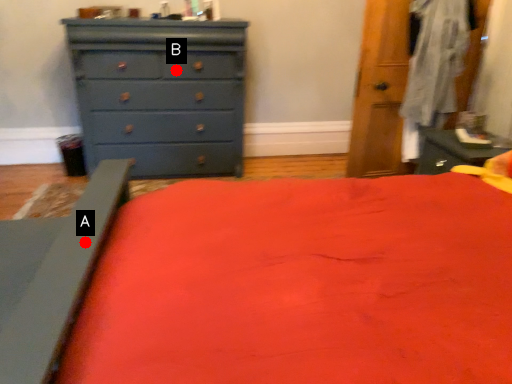
Question: Two points are circled on the image, labeled by A and B beside each circle. Among these points, which one is farthest from the camera?

Choices:
 (A) A is further
 (B) B is further

Answer: (B)